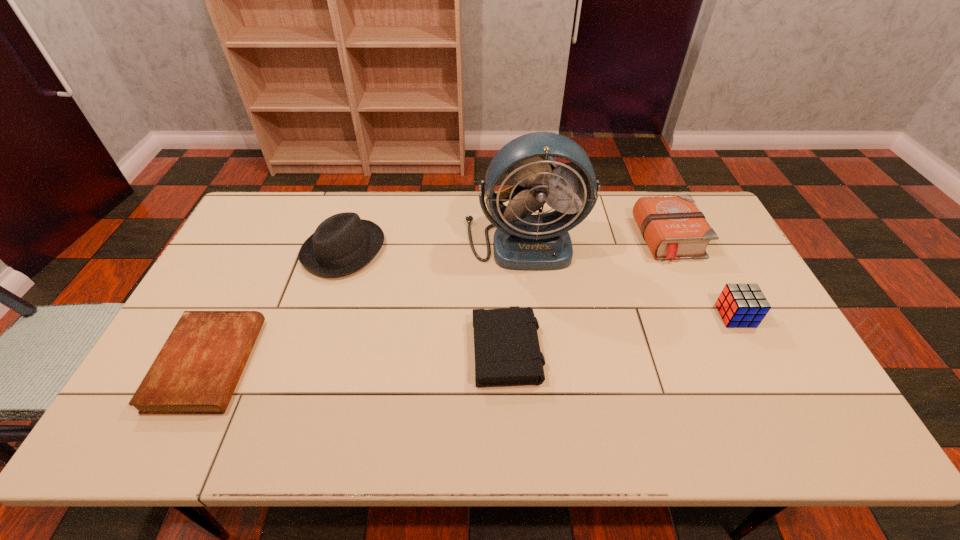
The height and width of the screenshot is (540, 960). I want to click on free spot located in front of the tallest object to blow air, so click(x=538, y=369).

Identify the location of vacant space located 0.180m on the back of the second object from left to right. This screenshot has width=960, height=540. (362, 192).

Locate an element on the screen. free region located on the left of the farthest Bible is located at coordinates (525, 239).

Image resolution: width=960 pixels, height=540 pixels. What are the coordinates of `vacant point located 0.180m on the left of the cube` in the screenshot? It's located at (656, 316).

Locate an element on the screen. The width and height of the screenshot is (960, 540). blank space located 0.100m on the right of the second tallest Bible is located at coordinates (580, 346).

Locate an element on the screen. Image resolution: width=960 pixels, height=540 pixels. free point located 0.230m on the spine side of the leftmost Bible is located at coordinates (340, 364).

I want to click on fan present at the far edge, so click(541, 242).

Locate an element on the screen. Image resolution: width=960 pixels, height=540 pixels. fedora at the far edge is located at coordinates (343, 243).

Find the location of a particular element. The image size is (960, 540). Bible that is at the far edge is located at coordinates point(673,227).

The width and height of the screenshot is (960, 540). I want to click on object located at the near edge, so click(x=198, y=368).